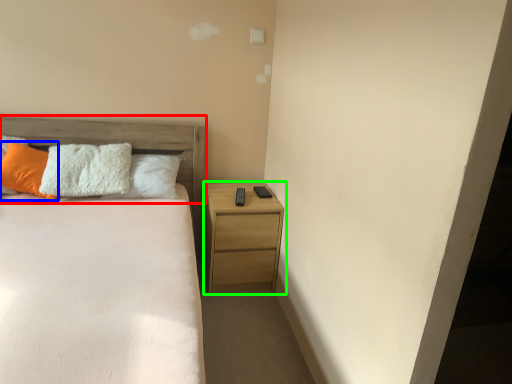
Question: Considering the real-world distances, which object is closest to headboard (highlighted by a red box)? pillow (highlighted by a blue box) or nightstand (highlighted by a green box).

Choices:
 (A) pillow
 (B) nightstand

Answer: (A)